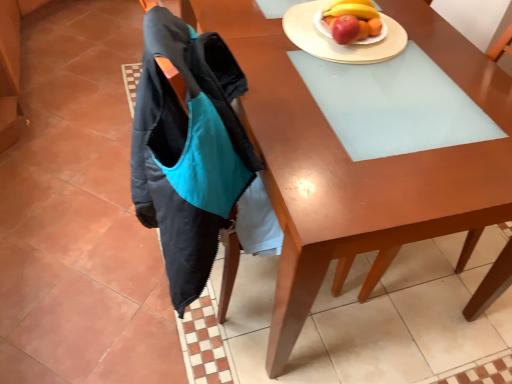
Where is `free spot above wooden plate at upper right, placed as the 1th plate when sorted from left to right (from a real-world perspective)`? free spot above wooden plate at upper right, placed as the 1th plate when sorted from left to right (from a real-world perspective) is located at coordinates (353, 38).